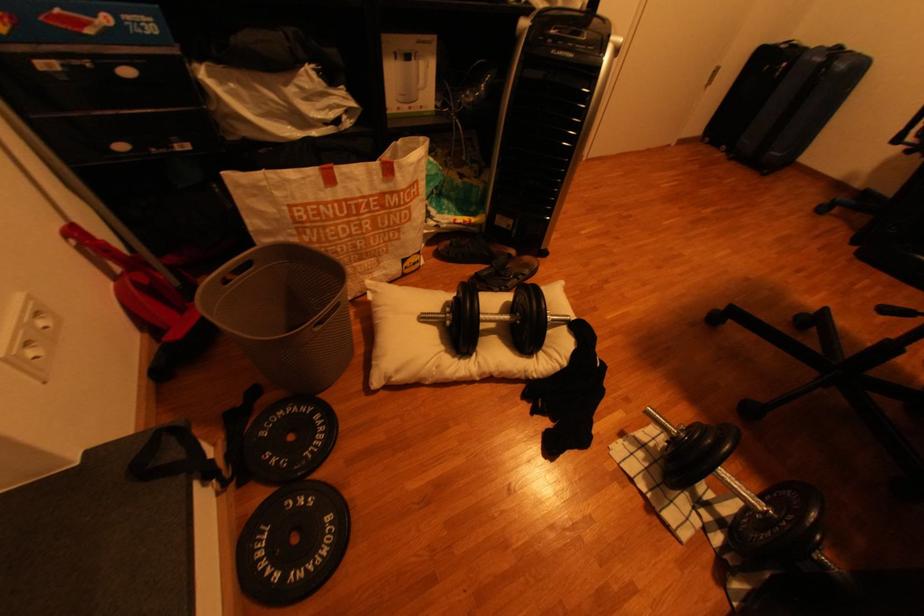
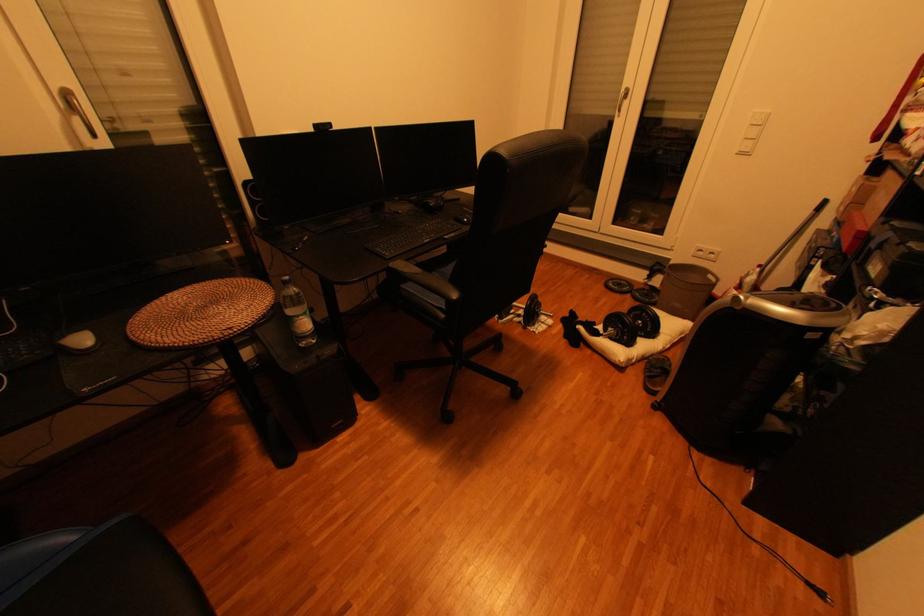
In the second image, find the point that corresponds to the point at 622,440 in the first image.

(564, 323)